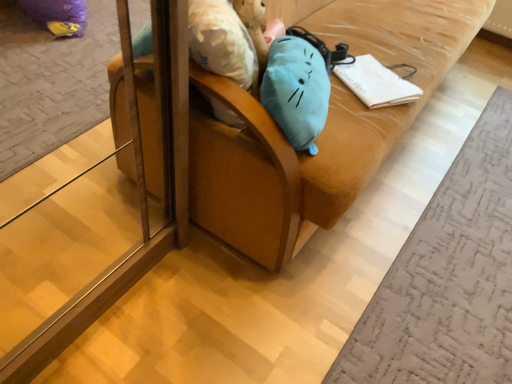
This screenshot has height=384, width=512. Identify the location of white paper at center. (376, 83).

What do you see at coordinates (376, 83) in the screenshot? This screenshot has width=512, height=384. I see `white paper at center` at bounding box center [376, 83].

Measure the distance between white paper at center and camera.

The distance of white paper at center from camera is 4.34 feet.

What is the approximate height of velvet brown armchair at center?

The height of velvet brown armchair at center is 93.65 centimeters.

Describe the element at coordinates (322, 132) in the screenshot. The height and width of the screenshot is (384, 512). I see `velvet brown armchair at center` at that location.

The height and width of the screenshot is (384, 512). What are the coordinates of `velvet brown armchair at center` in the screenshot? It's located at (322, 132).

Image resolution: width=512 pixels, height=384 pixels. I want to click on white paper at center, so click(376, 83).

In the scene shown: Considering the relative positions of velvet brown armchair at center and white paper at center in the image provided, is velvet brown armchair at center to the left of white paper at center from the viewer's perspective?

Indeed, velvet brown armchair at center is positioned on the left side of white paper at center.

Which object is closer to the camera, velvet brown armchair at center or white paper at center?

velvet brown armchair at center.

Which point is more distant from viewer, (195, 116) or (377, 80)?

The point (377, 80) is more distant.

From the image's perspective, is velvet brown armchair at center positioned above or below white paper at center?

velvet brown armchair at center is situated higher than white paper at center in the image.

Based on the photo, from a real-world perspective, is velvet brown armchair at center physically below white paper at center?

No, from a real-world perspective, velvet brown armchair at center is not under white paper at center.

Is velvet brown armchair at center thinner than white paper at center?

No, velvet brown armchair at center is not thinner than white paper at center.

Considering the relative sizes of velvet brown armchair at center and white paper at center in the image provided, is velvet brown armchair at center shorter than white paper at center?

In fact, velvet brown armchair at center may be taller than white paper at center.

Considering the sizes of objects velvet brown armchair at center and white paper at center in the image provided, who is bigger, velvet brown armchair at center or white paper at center?

With larger size is velvet brown armchair at center.

Do you think velvet brown armchair at center is within white paper at center, or outside of it?

velvet brown armchair at center is located beyond the bounds of white paper at center.

Are velvet brown armchair at center and white paper at center far apart?

No, velvet brown armchair at center is not far away from white paper at center.

Is velvet brown armchair at center oriented towards white paper at center?

Yes, velvet brown armchair at center is aimed at white paper at center.

Image resolution: width=512 pixels, height=384 pixels. Find the location of `notebook located underneath the velvet brown armchair at center (from a real-world perspective)`. notebook located underneath the velvet brown armchair at center (from a real-world perspective) is located at coordinates (376, 83).

From the picture: Considering the positions of objects white paper at center and velvet brown armchair at center in the image provided, who is more to the right, white paper at center or velvet brown armchair at center?

From the viewer's perspective, white paper at center appears more on the right side.

Which is behind, white paper at center or velvet brown armchair at center?

white paper at center is further from the camera.

Between point (373, 91) and point (413, 53), which one is positioned in front?

Positioned in front is point (373, 91).

From the image's perspective, is white paper at center positioned above or below velvet brown armchair at center?

From the image's perspective, white paper at center appears below velvet brown armchair at center.

From a real-world perspective, is white paper at center over velvet brown armchair at center?

No, from a real-world perspective, white paper at center is not above velvet brown armchair at center.

Which object is thinner, white paper at center or velvet brown armchair at center?

white paper at center.

From the picture: Is white paper at center shorter than velvet brown armchair at center?

Correct, white paper at center is not as tall as velvet brown armchair at center.

Looking at the image, does white paper at center seem bigger or smaller compared to velvet brown armchair at center?

white paper at center is smaller than velvet brown armchair at center.

Is velvet brown armchair at center inside white paper at center?

No, velvet brown armchair at center is not a part of white paper at center.

Can you see white paper at center touching velvet brown armchair at center?

No, white paper at center is not in contact with velvet brown armchair at center.

Is velvet brown armchair at center at the back of white paper at center?

Yes, velvet brown armchair at center is at the back of white paper at center.

Locate an element on the screen. Image resolution: width=512 pixels, height=384 pixels. notebook on the right side of velvet brown armchair at center is located at coordinates (376, 83).

You are a GUI agent. You are given a task and a screenshot of the screen. Output one action in this format:
    pyautogui.click(x=<x>, y=<y>)
    Task: Click on the notebook behind the velvet brown armchair at center
    The height and width of the screenshot is (384, 512).
    Given the screenshot: What is the action you would take?
    pyautogui.click(x=376, y=83)

This screenshot has width=512, height=384. Identify the location of furniture that appears on the left of white paper at center. (322, 132).